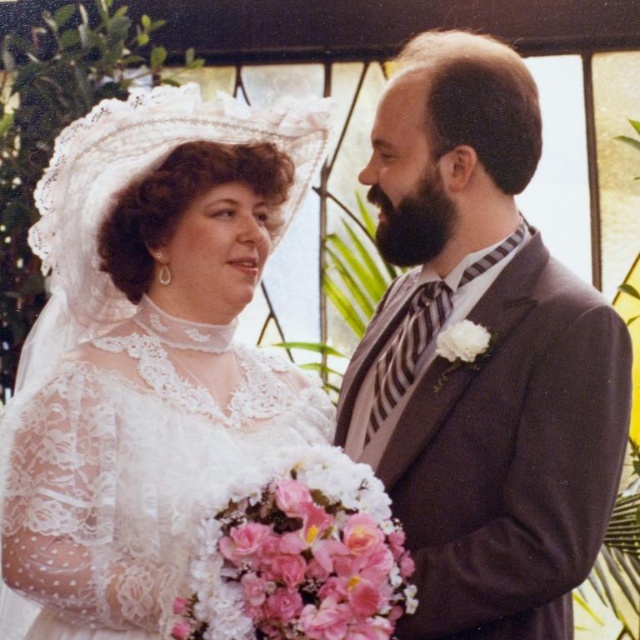
Can you confirm if pink floral bouquet at center is smaller than white matte flower at upper right?

No.

You are a GUI agent. You are given a task and a screenshot of the screen. Output one action in this format:
    pyautogui.click(x=<x>, y=<y>)
    Task: Click on the pink floral bouquet at center
    The image size is (640, 640).
    Given the screenshot: What is the action you would take?
    pyautogui.click(x=300, y=557)

What are the coordinates of `pink floral bouquet at center` in the screenshot? It's located at (300, 557).

Is point (170, 589) in front of point (444, 356)?

Yes, point (170, 589) is in front of point (444, 356).

Is white lace dress at left wider than white matte flower at upper right?

Yes, white lace dress at left is wider than white matte flower at upper right.

Who is more forward, (109, 339) or (477, 333)?

Point (477, 333) is in front.

Identify the location of white lace dress at left. Image resolution: width=640 pixels, height=640 pixels. [147, 355].

Is white lace dress at left taller than matte gray suit at center?

Yes, white lace dress at left is taller than matte gray suit at center.

Who is higher up, white lace dress at left or matte gray suit at center?

matte gray suit at center

Is point (150, 637) positioned in front of point (442, 307)?

Yes, it is in front of point (442, 307).

Where is `white lace dress at left`? white lace dress at left is located at coordinates (147, 355).